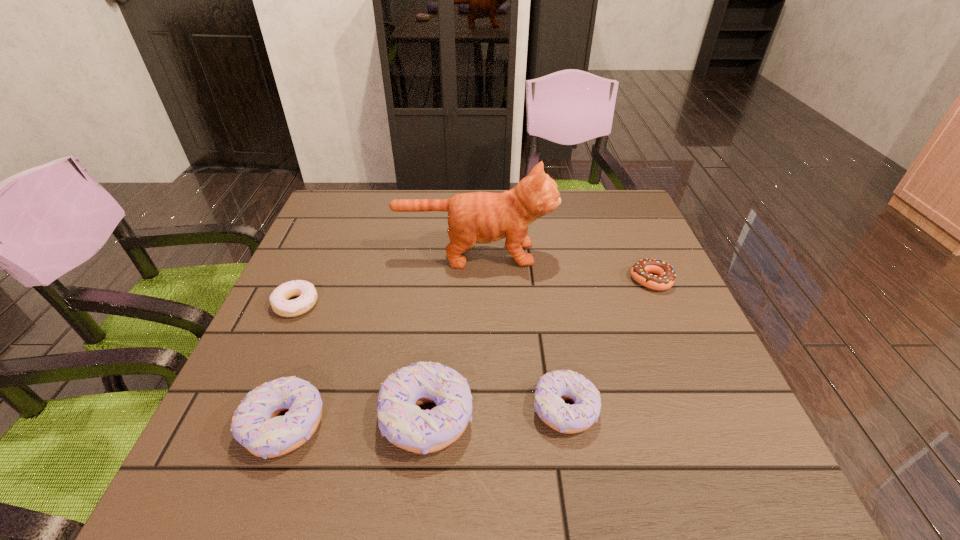
Find the location of `the fourth shortest doughnut`. the fourth shortest doughnut is located at coordinates (256, 425).

The width and height of the screenshot is (960, 540). What are the coordinates of `the third doughnut from left to right` in the screenshot? It's located at (400, 419).

Where is `the third shortest object`? the third shortest object is located at coordinates click(553, 388).

Where is `the second doughnut from right to left`? The image size is (960, 540). the second doughnut from right to left is located at coordinates (553, 388).

At what (x,y) coordinates should I click in order to perform the action: click on the tallest object. Please return your answer as a coordinate pair (x, y). Image resolution: width=960 pixels, height=540 pixels. Looking at the image, I should click on (478, 217).

The width and height of the screenshot is (960, 540). In order to click on the rightmost doughnut in this screenshot , I will do `click(641, 271)`.

Where is `free region located on the back of the second tallest doughnut`? The height and width of the screenshot is (540, 960). free region located on the back of the second tallest doughnut is located at coordinates (306, 366).

The width and height of the screenshot is (960, 540). Identify the location of free region located on the back of the third doughnut from left to right. (442, 268).

Where is `vacant space located 0.180m on the right of the third shortest doughnut`? The image size is (960, 540). vacant space located 0.180m on the right of the third shortest doughnut is located at coordinates (695, 409).

Locate an element on the screen. This screenshot has height=540, width=960. vacant space situated 0.110m on the face of the tallest object is located at coordinates (595, 254).